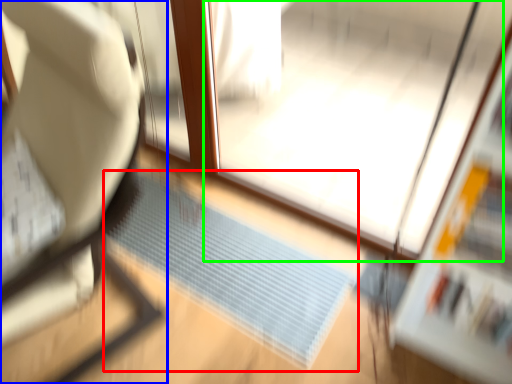
Question: Which is farther away from doormat (highlighted by a red box)? furniture (highlighted by a blue box) or screen door (highlighted by a green box)?

Choices:
 (A) furniture
 (B) screen door

Answer: (A)